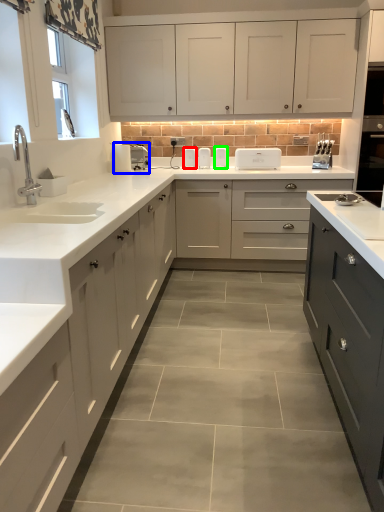
Question: Estimate the real-world distances between objects in this image. Which object is farther from appliance (highlighted by a red box), appliance (highlighted by a blue box) or appliance (highlighted by a green box)?

Choices:
 (A) appliance
 (B) appliance

Answer: (A)